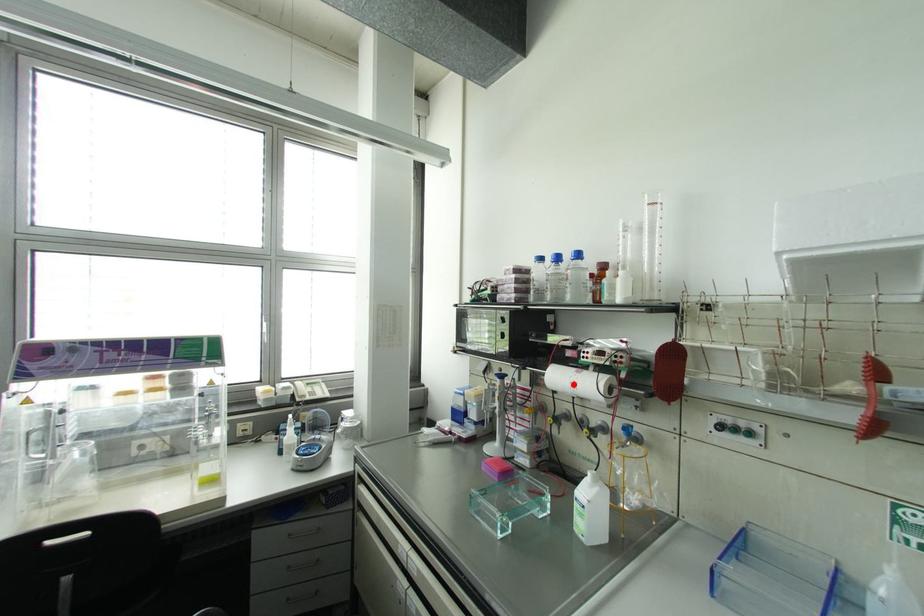
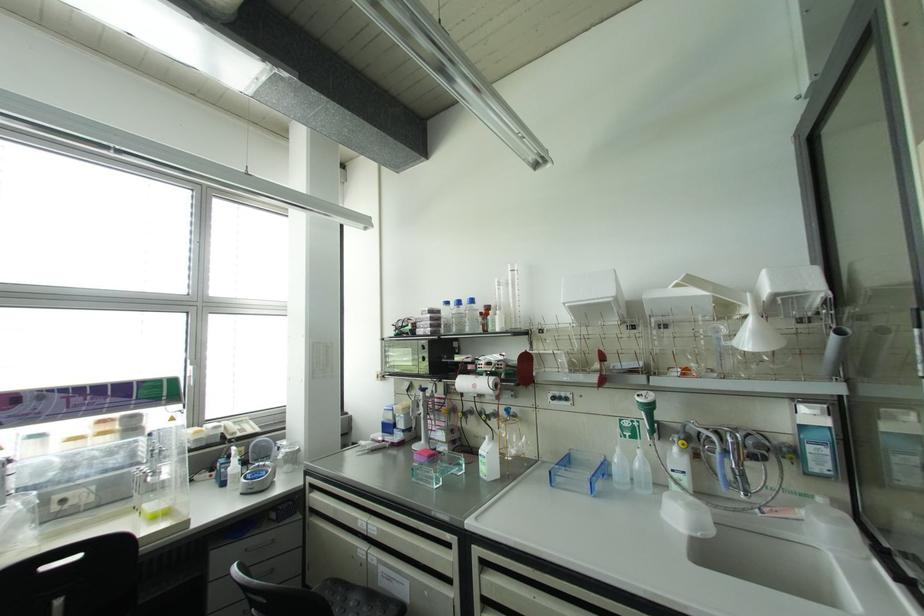
Where in the second image is the point corresponding to the highlighted location from the first image?

(473, 386)